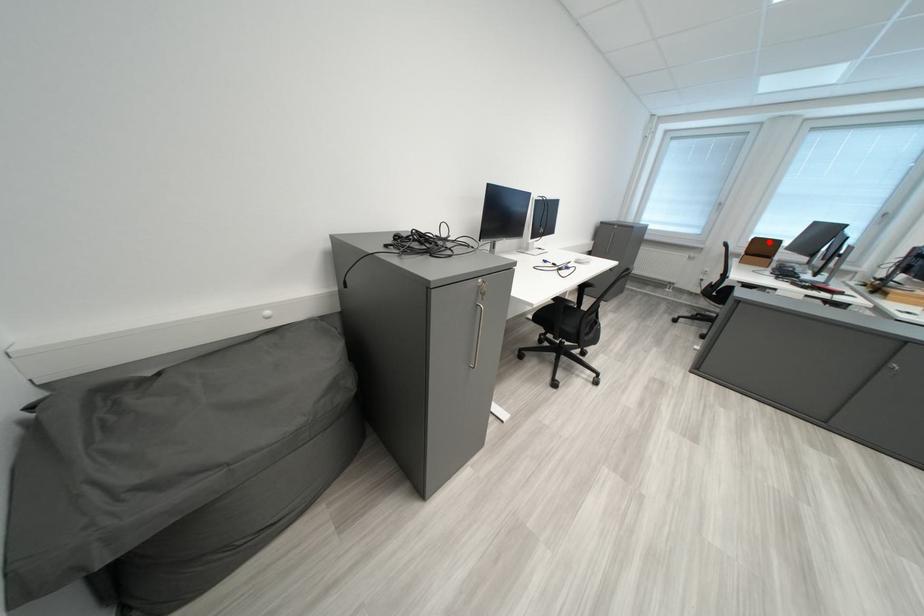
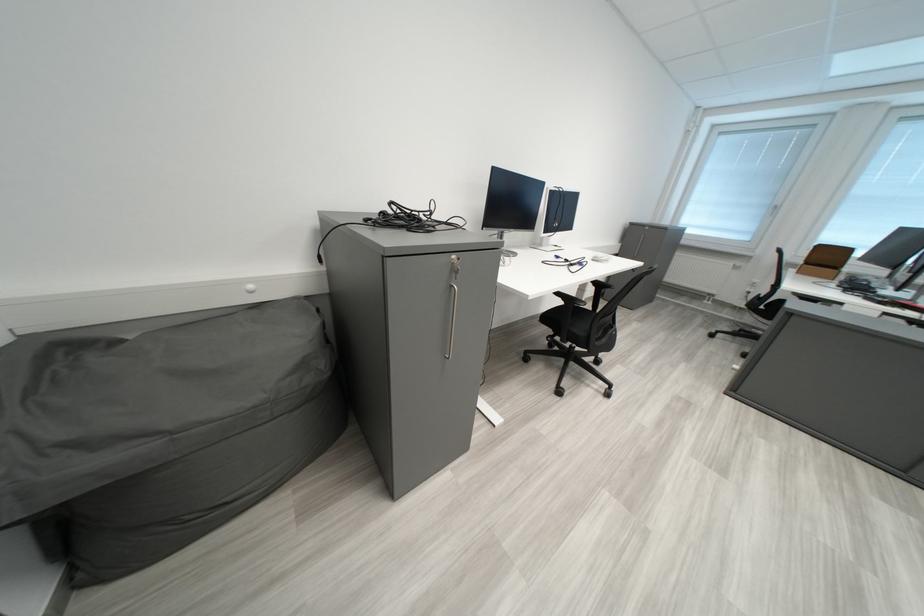
Question: I am providing you with two images of the same scene from different viewpoints. A red point is shown in image1. For the corresponding object point in image2, is it positioned nearer or farther from the camera?

Choices:
 (A) Nearer
 (B) Farther

Answer: (B)